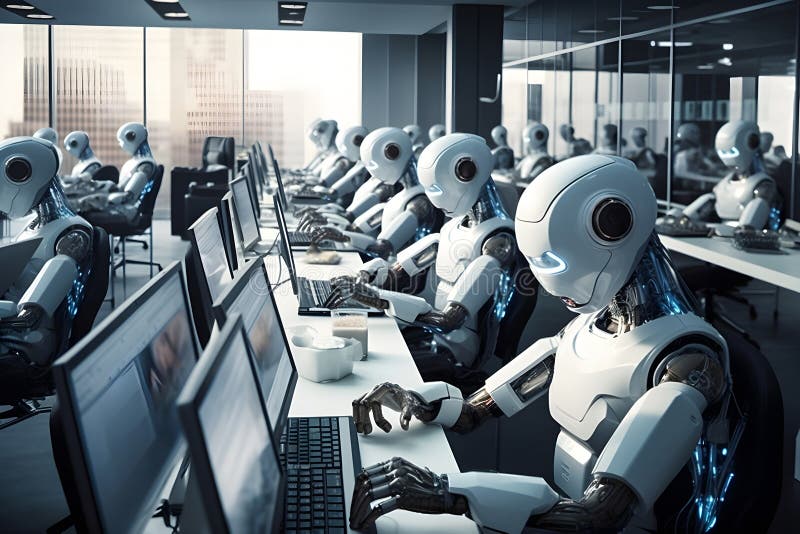
Locate an element on the screen. Image resolution: width=800 pixels, height=534 pixels. keyboards is located at coordinates (326, 475), (326, 293), (300, 240), (301, 192), (686, 233).